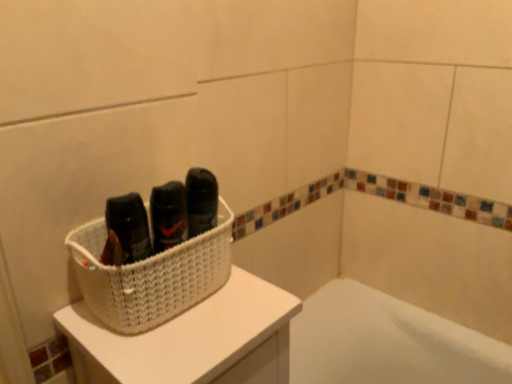
Question: In terms of height, does white woven basket at upper left look taller or shorter compared to white woven basket at upper left?

Choices:
 (A) short
 (B) tall

Answer: (A)

Question: Considering their positions, is white woven basket at upper left located in front of or behind white woven basket at upper left?

Choices:
 (A) front
 (B) behind

Answer: (B)

Question: Visually, is white woven basket at upper left positioned to the left or to the right of white woven basket at upper left?

Choices:
 (A) right
 (B) left

Answer: (B)

Question: Considering the positions of white woven basket at upper left and white woven basket at upper left in the image, is white woven basket at upper left wider or thinner than white woven basket at upper left?

Choices:
 (A) wide
 (B) thin

Answer: (A)

Question: Is white woven basket at upper left taller or shorter than white woven basket at upper left?

Choices:
 (A) tall
 (B) short

Answer: (A)

Question: From a real-world perspective, is white woven basket at upper left positioned above or below white woven basket at upper left?

Choices:
 (A) below
 (B) above

Answer: (A)

Question: From the image's perspective, is white woven basket at upper left located above or below white woven basket at upper left?

Choices:
 (A) below
 (B) above

Answer: (A)